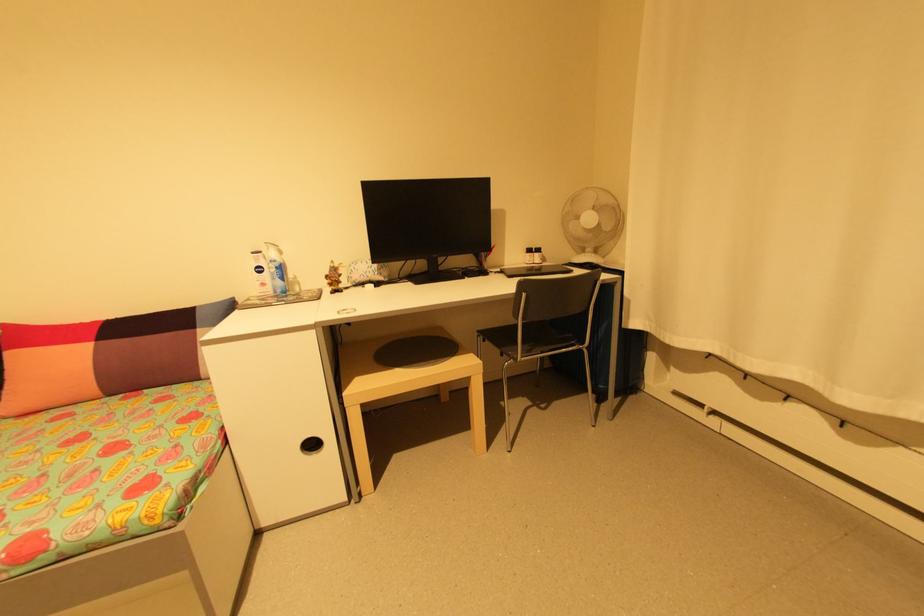
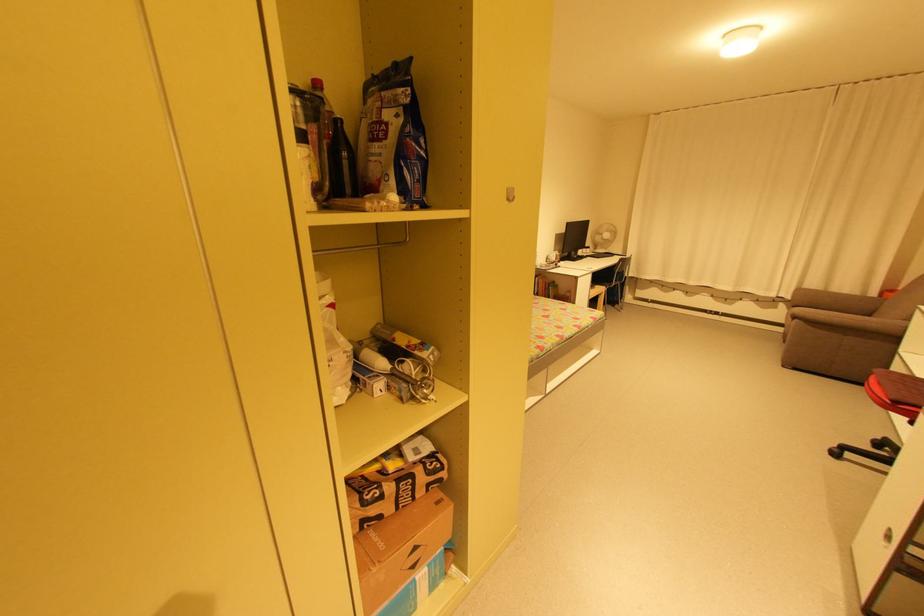
In the second image, find the point that corresponds to the point at 541,254 in the first image.

(592, 249)